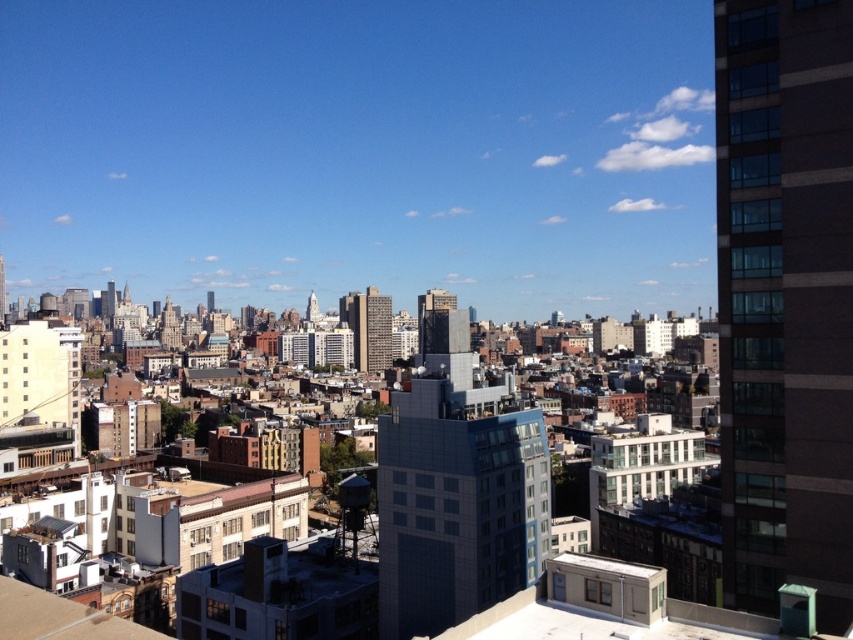
Can you confirm if glassy reflective building at right is positioned to the right of blue glass building at center?

Correct, you'll find glassy reflective building at right to the right of blue glass building at center.

Does point (735, 13) come farther from viewer compared to point (480, 400)?

No, (735, 13) is closer to viewer.

Where is `glassy reflective building at right`? This screenshot has width=853, height=640. glassy reflective building at right is located at coordinates (784, 300).

Which is more to the right, blue glass building at center or smooth concrete skyscraper at center?

From the viewer's perspective, blue glass building at center appears more on the right side.

In order to click on blue glass building at center in this screenshot , I will do `click(456, 484)`.

Can you confirm if glassy reflective building at right is positioned to the left of matte gray building at center?

No, glassy reflective building at right is not to the left of matte gray building at center.

Consider the image. Between glassy reflective building at right and matte gray building at center, which one is positioned higher?

matte gray building at center

This screenshot has width=853, height=640. What do you see at coordinates (784, 300) in the screenshot?
I see `glassy reflective building at right` at bounding box center [784, 300].

The height and width of the screenshot is (640, 853). Identify the location of glassy reflective building at right. (784, 300).